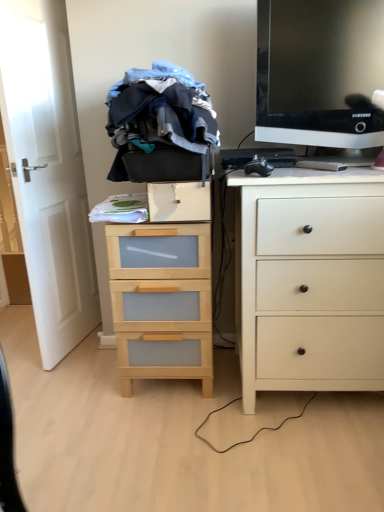
Identify the location of vacant space to the left of wooden chest of drawers at center, the 1th chest of drawers from the left. (85, 394).